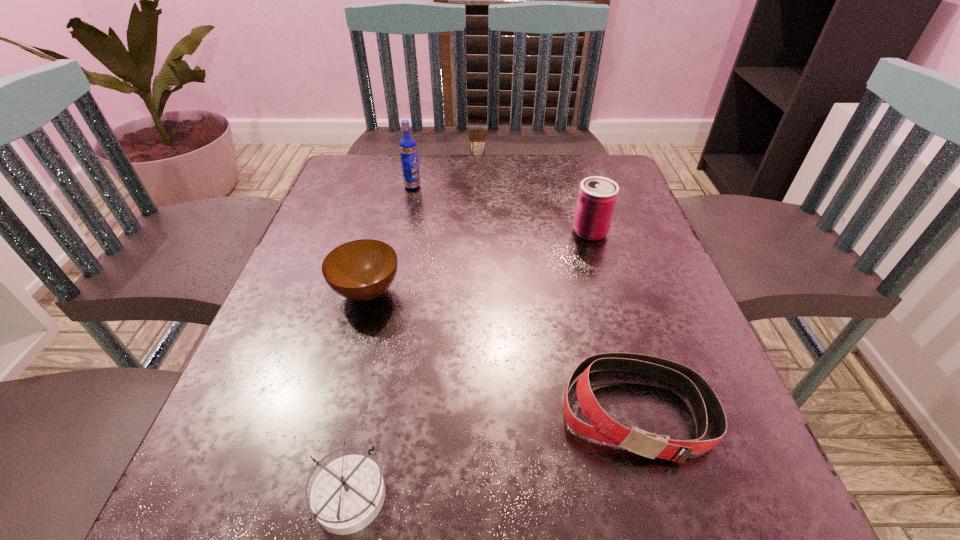
The width and height of the screenshot is (960, 540). Find the location of `free space located 0.210m on the back of the dog collar`. free space located 0.210m on the back of the dog collar is located at coordinates [599, 279].

Where is `free point located on the left of the compass`? free point located on the left of the compass is located at coordinates (244, 494).

This screenshot has width=960, height=540. In order to click on object present at the far edge in this screenshot , I will do `click(408, 149)`.

Where is `object that is at the near edge`? object that is at the near edge is located at coordinates (x=347, y=495).

At what (x,y) coordinates should I click in order to perform the action: click on object at the left edge. Please return your answer as a coordinate pair (x, y). The width and height of the screenshot is (960, 540). Looking at the image, I should click on (359, 270).

The height and width of the screenshot is (540, 960). In order to click on can present at the right edge in this screenshot , I will do `click(597, 196)`.

Where is `dog collar that is at the right edge`? This screenshot has height=540, width=960. dog collar that is at the right edge is located at coordinates (603, 428).

At what (x,y) coordinates should I click in order to perform the action: click on vacant space at the far edge of the desktop. Please return your answer as a coordinate pair (x, y). Image resolution: width=960 pixels, height=540 pixels. Looking at the image, I should click on (518, 194).

In the image, there is a desktop. Where is `free region at the near edge`? This screenshot has width=960, height=540. free region at the near edge is located at coordinates (411, 497).

The height and width of the screenshot is (540, 960). In the image, there is a desktop. What are the coordinates of `vacant area at the left edge` in the screenshot? It's located at (289, 413).